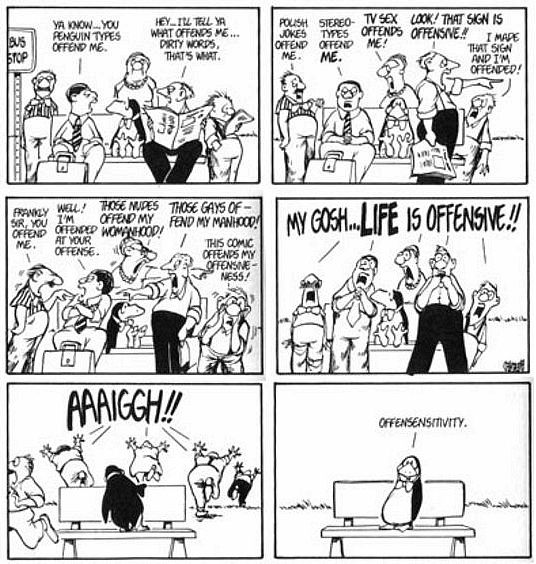
This screenshot has width=536, height=564. Find the location of `frame`. frame is located at coordinates (148, 442), (315, 440), (352, 301), (180, 271), (148, 54), (373, 43).